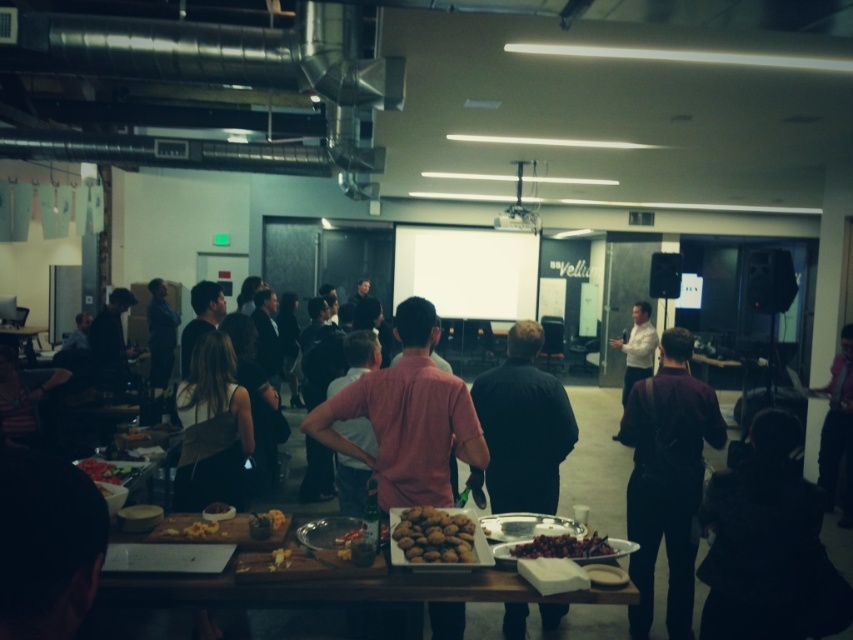
You are standing at the back of the room and want to grab a snack from the smooth brown bowl at center without walking past the white matte projection screen at center. Is this possible?

The white matte projection screen at center is further to the viewer than the smooth brown bowl at center, so you can reach the smooth brown bowl at center without passing the white matte projection screen at center.

You are at the event and want to move from your current position to the food table. You see two points marked in the image. The first point is at coordinate point [525,273] and the second is at point [204,509]. Which point should you head towards to reach the food table more directly?

Point [204,509] is in front of point [525,273], so you should head towards point [204,509] to reach the food table more directly since it is closer to you.